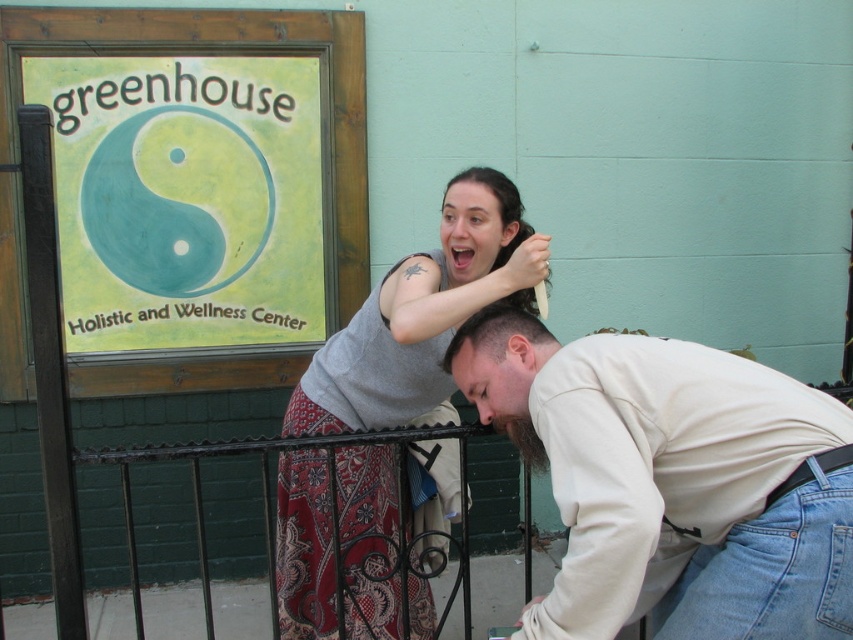
You are a photographer trying to capture a candid shot of the two people in the scene. You want to ensure that both the beige cotton shirt at lower right and the dark brown hair at upper center are clearly visible in the frame. Given their sizes, which object should you focus on to ensure both are in focus?

The beige cotton shirt at lower right is bigger than the dark brown hair at upper center, so focusing on the beige cotton shirt at lower right would ensure both are in focus since it is larger and easier to capture clearly.

Based on the scene described, which object is smaller in size between the beige cotton shirt at lower right and the gray fabric shirt at center?

The beige cotton shirt at lower right is smaller in size compared to the gray fabric shirt at center according to the description.

You are standing in front of the Greenhouse Holistic and Wellness Center. You see two points marked in the image. The first point is at coordinates point (450, 314) and the second point is at point (447, 371). Which point is closer to you?

Point (450, 314) is in front of point (447, 371), so it is closer to you.